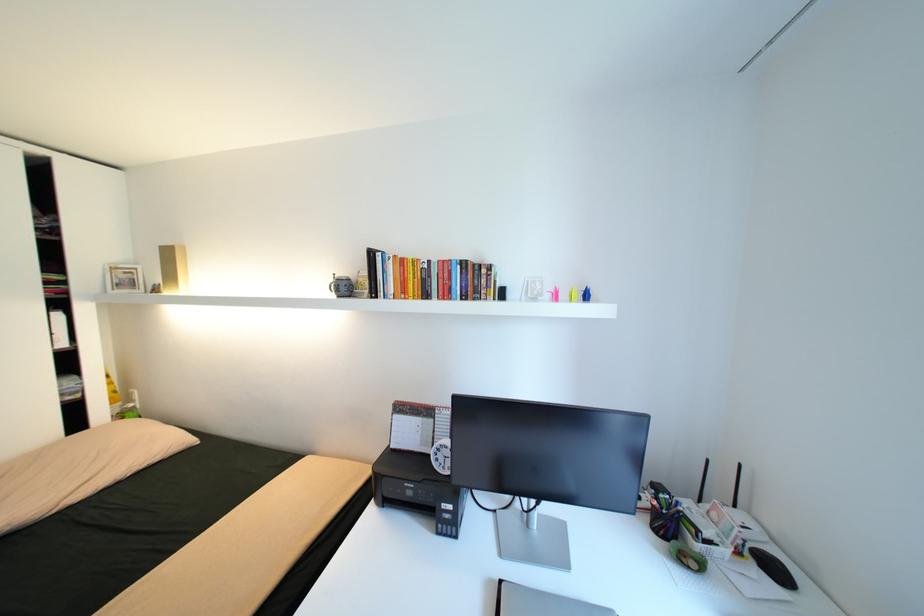
Describe the element at coordinates (541, 602) in the screenshot. The height and width of the screenshot is (616, 924). I see `a laptop lid` at that location.